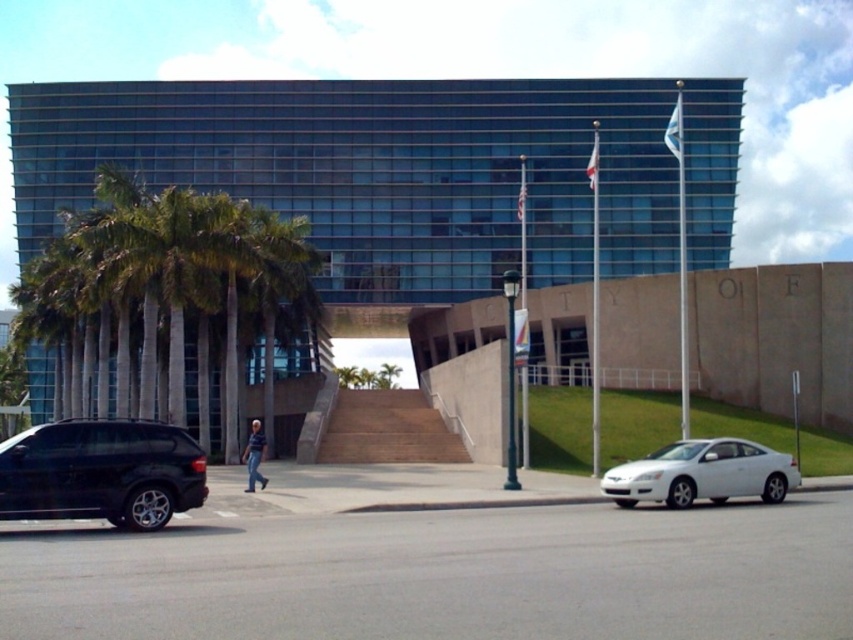
Question: Which of the following is the closest to the observer?

Choices:
 (A) white glossy car at lower right
 (B) shiny black suv at lower left

Answer: (B)

Question: Does shiny black suv at lower left appear over white glossy car at lower right?

Choices:
 (A) no
 (B) yes

Answer: (B)

Question: Observing the image, what is the correct spatial positioning of shiny black suv at lower left in reference to white glossy car at lower right?

Choices:
 (A) left
 (B) right

Answer: (A)

Question: Which point appears farthest from the camera in this image?

Choices:
 (A) (93, 468)
 (B) (718, 476)

Answer: (B)

Question: Among these objects, which one is nearest to the camera?

Choices:
 (A) shiny black suv at lower left
 (B) white glossy car at lower right

Answer: (A)

Question: Does shiny black suv at lower left appear on the left side of white glossy car at lower right?

Choices:
 (A) yes
 (B) no

Answer: (A)